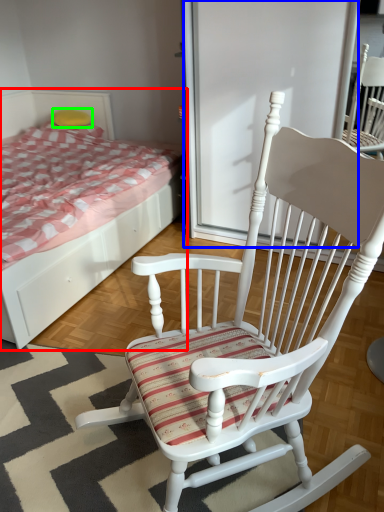
Question: Considering the real-world distances, which object is farthest from bed (highlighted by a red box)? screen door (highlighted by a blue box) or pillow (highlighted by a green box)?

Choices:
 (A) screen door
 (B) pillow

Answer: (B)